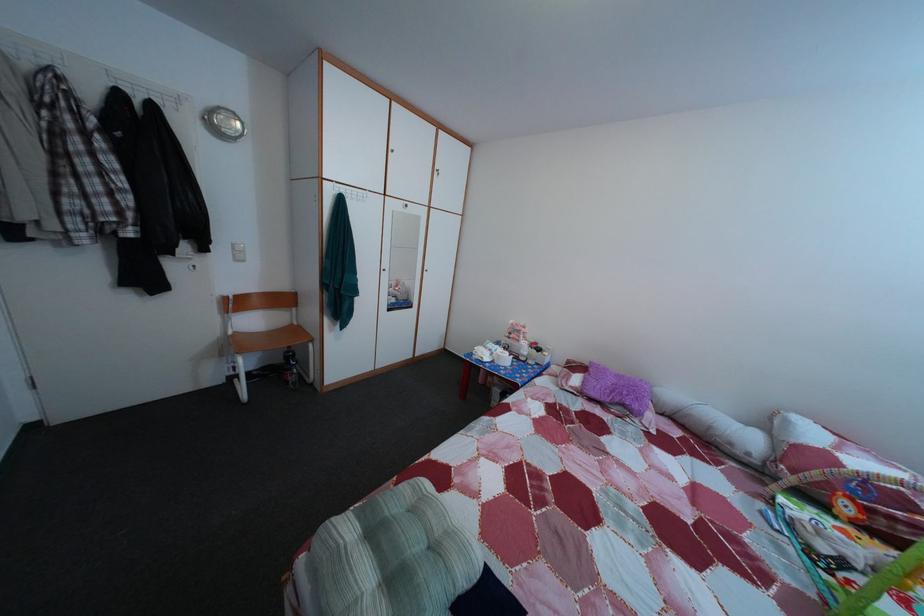
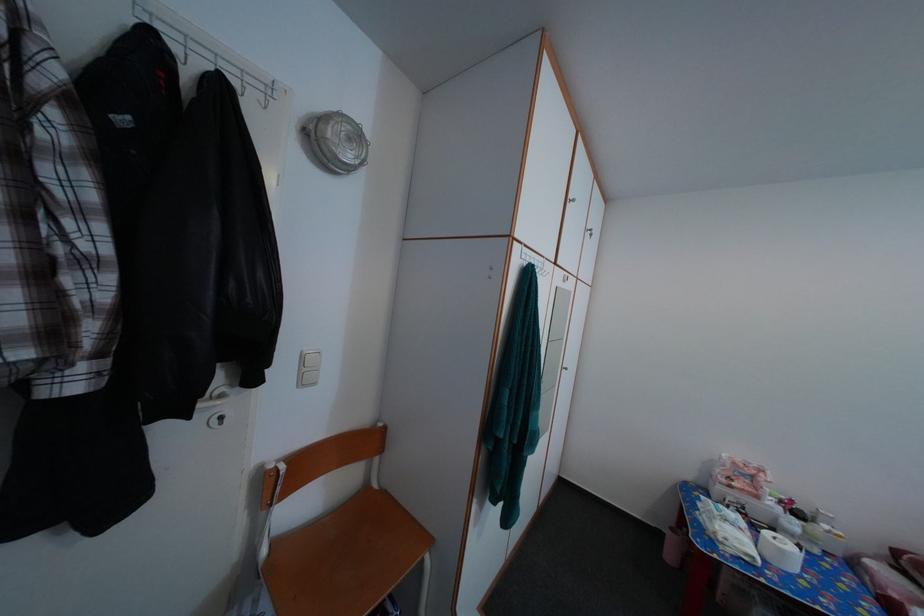
Find the pixel in the second image that matches (245,339) in the first image.

(282, 552)